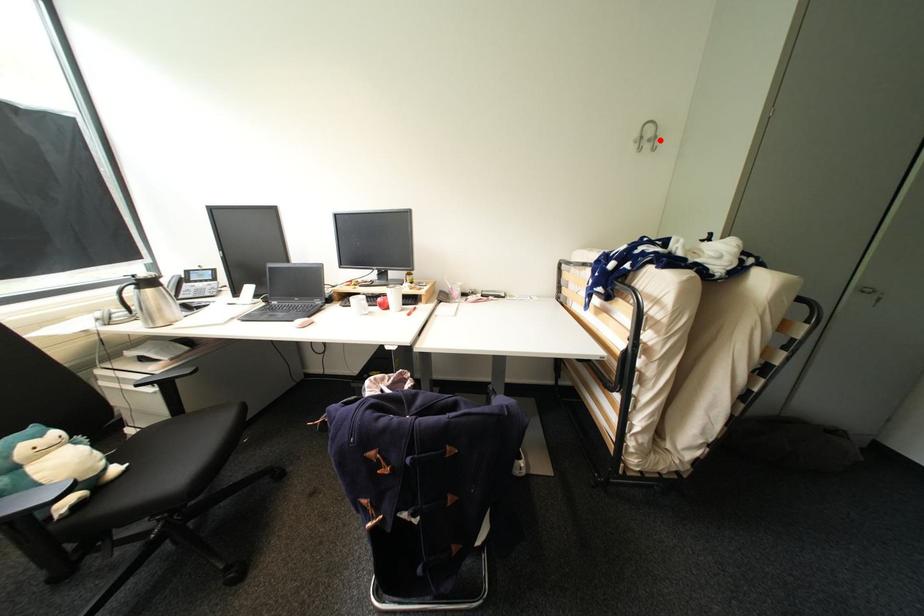
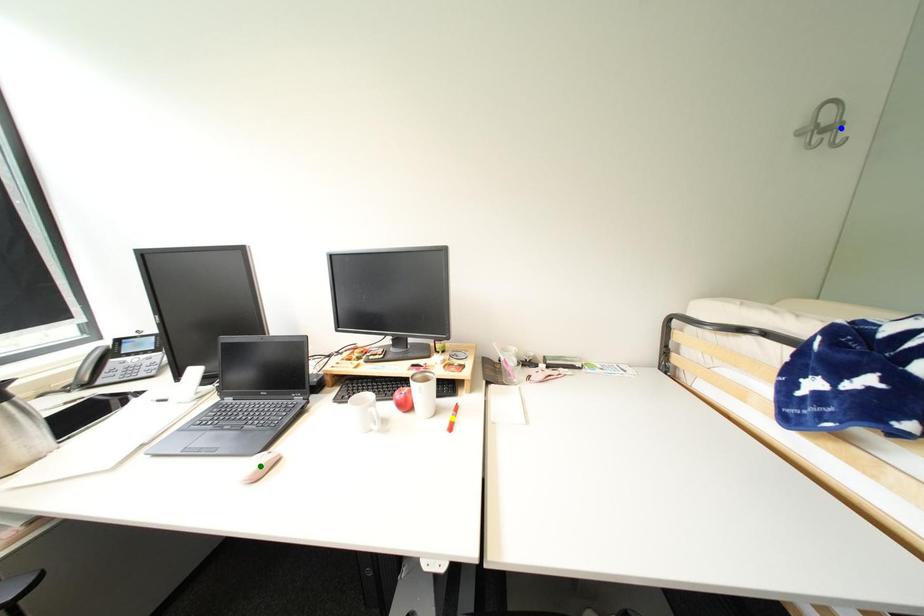
Question: I am providing you with two images of the same scene from different viewpoints. A red point is marked on the first image. You are given multiple points on the second image. In image 2, which mark is for the same physical point as the one in image 1?

Choices:
 (A) yellow point
 (B) blue point
 (C) green point

Answer: (B)